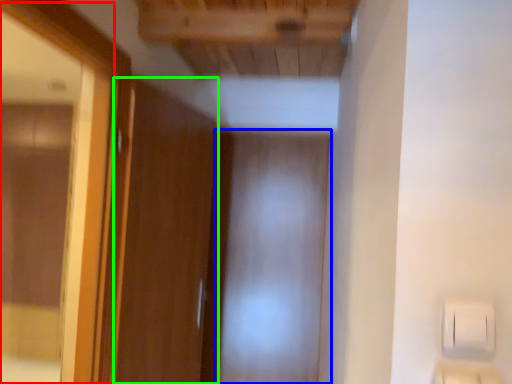
Question: Which object is positioned farthest from mirror (highlighted by a red box)? Select from screen door (highlighted by a blue box) and door (highlighted by a green box).

Choices:
 (A) screen door
 (B) door

Answer: (A)